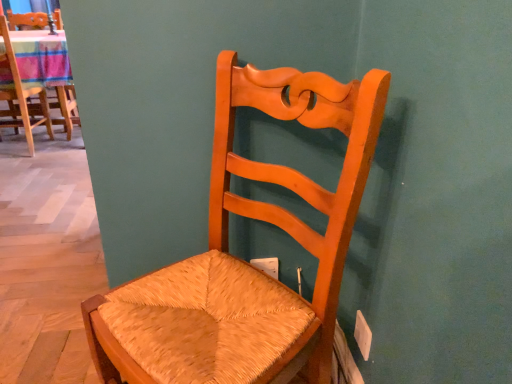
Question: Is woven straw chair at upper left, which is the first chair in back-to-front order, taller than matte wood chair at center, which is the first chair from front to back?

Choices:
 (A) no
 (B) yes

Answer: (A)

Question: From the image's perspective, is woven straw chair at upper left, which is the first chair in back-to-front order, below matte wood chair at center, the 2th chair when ordered from left to right?

Choices:
 (A) no
 (B) yes

Answer: (A)

Question: Does woven straw chair at upper left, the second chair when ordered from bottom to top, come behind matte wood chair at center, positioned as the 2th chair in back-to-front order?

Choices:
 (A) yes
 (B) no

Answer: (A)

Question: Does woven straw chair at upper left, which is the first chair in back-to-front order, have a lesser height compared to matte wood chair at center, the 1th chair positioned from the right?

Choices:
 (A) yes
 (B) no

Answer: (A)

Question: Is the position of woven straw chair at upper left, placed as the second chair when sorted from right to left, less distant than that of matte wood chair at center, which is the first chair from front to back?

Choices:
 (A) yes
 (B) no

Answer: (B)

Question: From a real-world perspective, is woven straw chair at upper left, placed as the second chair when sorted from right to left, physically above matte wood chair at center, the first chair in the bottom-to-top sequence?

Choices:
 (A) no
 (B) yes

Answer: (B)

Question: Is there a large distance between matte wood chair at center, the 2th chair when ordered from left to right, and woven straw chair at upper left, which is the first chair from top to bottom?

Choices:
 (A) no
 (B) yes

Answer: (B)

Question: Is matte wood chair at center, which is the first chair from front to back, positioned with its back to woven straw chair at upper left, which is the first chair in back-to-front order?

Choices:
 (A) yes
 (B) no

Answer: (B)

Question: From a real-world perspective, is matte wood chair at center, which appears as the 2th chair when viewed from the top, located higher than woven straw chair at upper left, which is counted as the second chair, starting from the front?

Choices:
 (A) yes
 (B) no

Answer: (B)

Question: Does matte wood chair at center, which appears as the 2th chair when viewed from the top, have a greater width compared to woven straw chair at upper left, which is counted as the second chair, starting from the front?

Choices:
 (A) no
 (B) yes

Answer: (B)

Question: Is matte wood chair at center, which appears as the 2th chair when viewed from the top, aimed at woven straw chair at upper left, positioned as the first chair in left-to-right order?

Choices:
 (A) yes
 (B) no

Answer: (B)

Question: From a real-world perspective, is matte wood chair at center, positioned as the 2th chair in back-to-front order, located beneath woven straw chair at upper left, placed as the second chair when sorted from right to left?

Choices:
 (A) no
 (B) yes

Answer: (B)

Question: From their relative heights in the image, would you say woven straw chair at upper left, which is the first chair in back-to-front order, is taller or shorter than matte wood chair at center, the 2th chair when ordered from left to right?

Choices:
 (A) short
 (B) tall

Answer: (A)